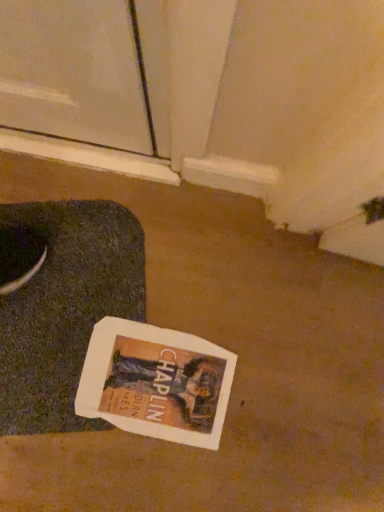
At what (x,y) coordinates should I click in order to perform the action: click on vacant area in front of white paper magazine at center. Please return your answer as a coordinate pair (x, y). The image size is (384, 512). Looking at the image, I should click on (107, 468).